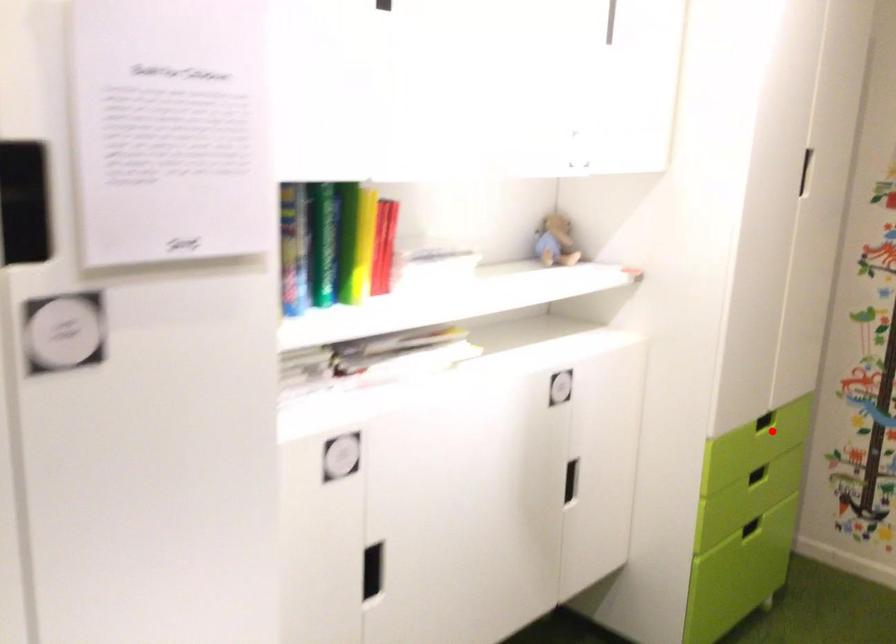
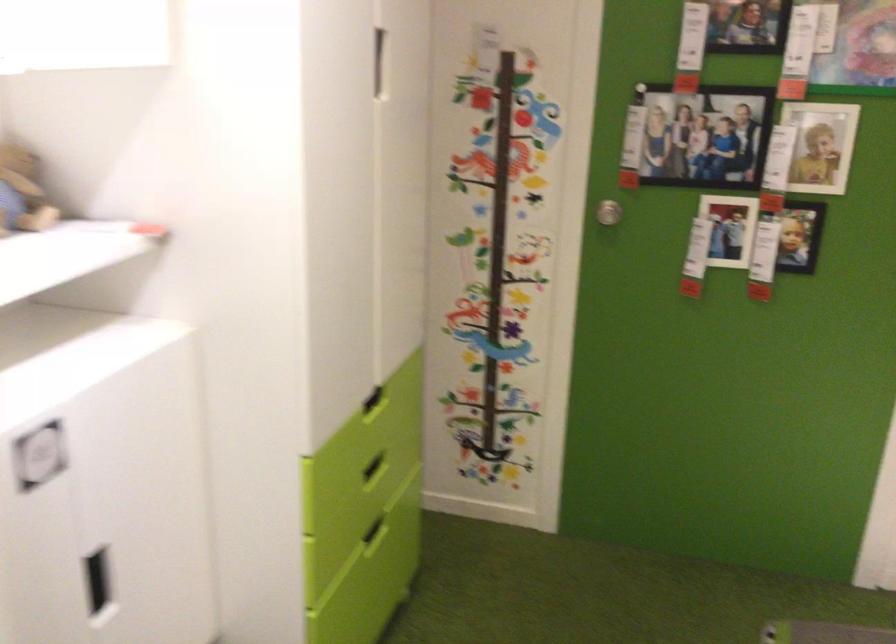
The point at the highlighted location is marked in the first image. Where is the corresponding point in the second image?

(373, 401)